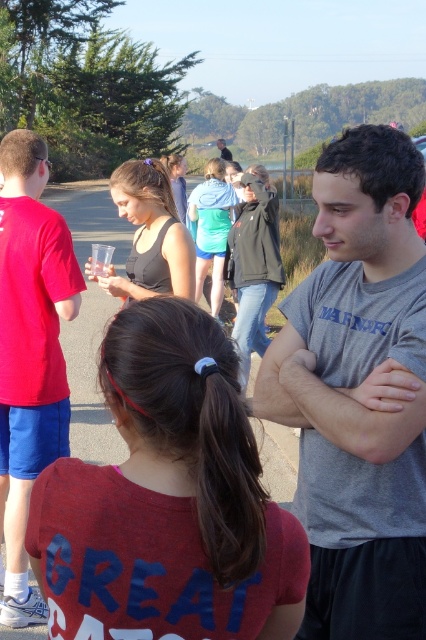
Does gray cotton t-shirt at center lie behind matte black jacket at center?

No, gray cotton t-shirt at center is closer to the viewer.

Is point (371, 216) positioned in front of point (224, 150)?

Yes.

Where is `gray cotton t-shirt at center`? gray cotton t-shirt at center is located at coordinates (359, 392).

Who is positioned more to the right, gray cotton t-shirt at center or matte red t-shirt at left?

Positioned to the right is gray cotton t-shirt at center.

Who is taller, gray cotton t-shirt at center or matte red t-shirt at left?

matte red t-shirt at left

Where is `gray cotton t-shirt at center`? The width and height of the screenshot is (426, 640). gray cotton t-shirt at center is located at coordinates (359, 392).

Does matte red t-shirt at left have a greater width compared to matte black jacket at center?

No.

Does point (14, 136) come behind point (227, 154)?

No, (14, 136) is in front of (227, 154).

You are a GUI agent. You are given a task and a screenshot of the screen. Output one action in this format:
    pyautogui.click(x=<x>, y=<y>)
    Task: Click on the matte red t-shirt at left
    The height and width of the screenshot is (640, 426).
    Given the screenshot: What is the action you would take?
    pyautogui.click(x=29, y=353)